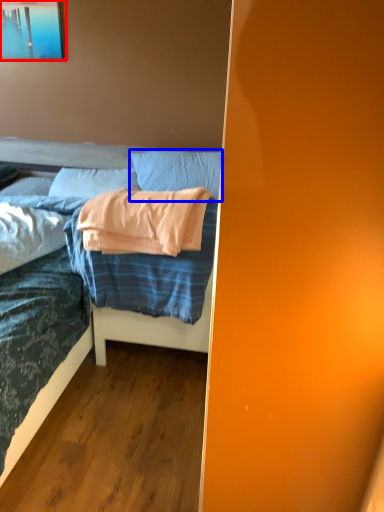
Question: Which of the following is the closest to the observer, picture frame (highlighted by a red box) or pillow (highlighted by a blue box)?

Choices:
 (A) picture frame
 (B) pillow

Answer: (B)